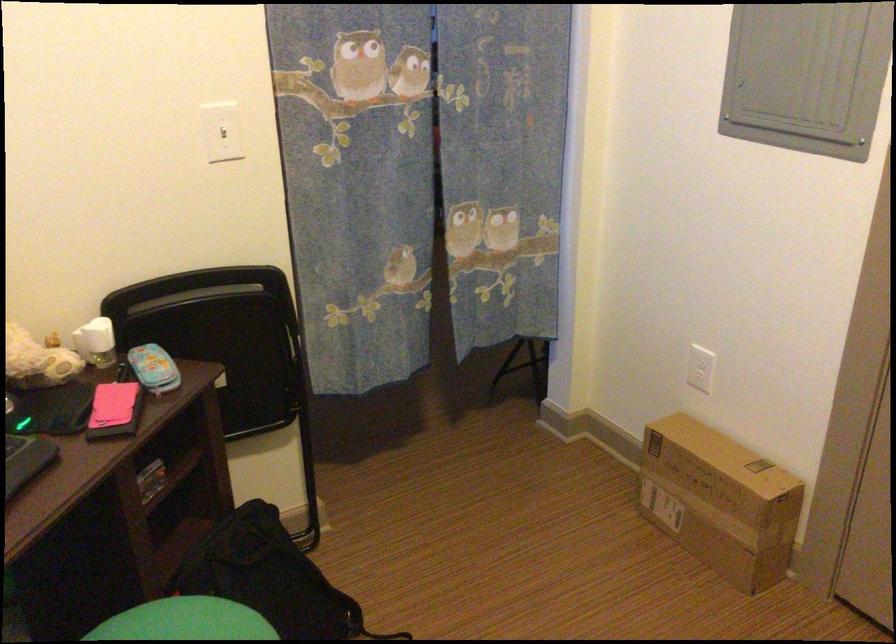
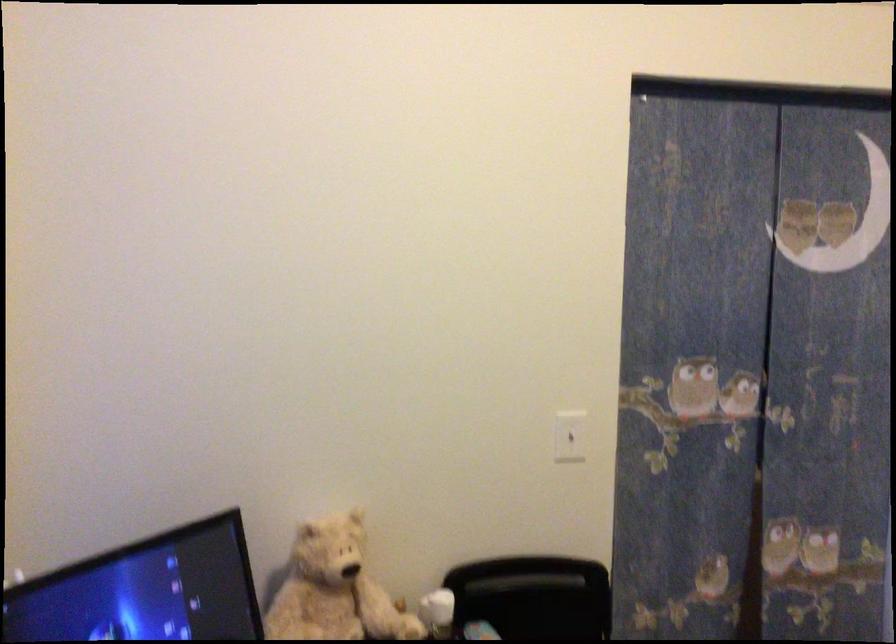
Where in the second image is the point corresponding to (219,131) from the first image?

(570, 436)